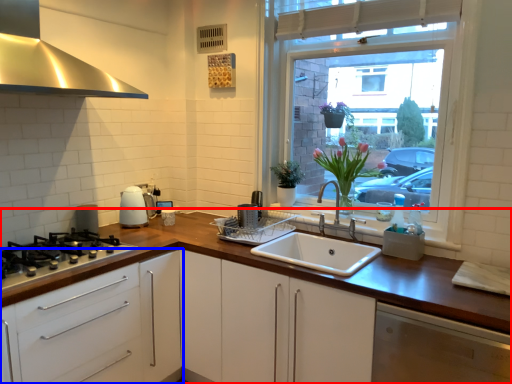
Question: Which point is closer to the camera, countertop (highlighted by a red box) or cabinetry (highlighted by a blue box)?

Choices:
 (A) countertop
 (B) cabinetry

Answer: (B)